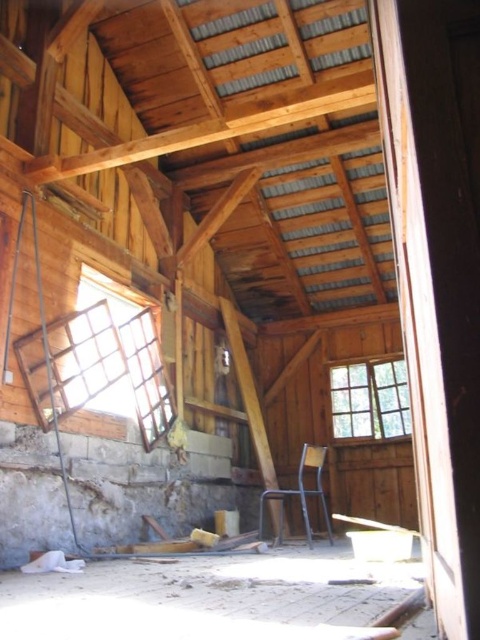
Question: Where is clear glass window at upper left located in relation to metallic chair at center in the image?

Choices:
 (A) below
 (B) above

Answer: (B)

Question: Which point is farther to the camera?

Choices:
 (A) clear glass window at upper left
 (B) clear glass window at right

Answer: (B)

Question: Which point is farther to the camera?

Choices:
 (A) (405, 420)
 (B) (308, 524)
 (C) (80, 294)

Answer: (A)

Question: Considering the relative positions of clear glass window at upper left and clear glass window at right in the image provided, where is clear glass window at upper left located with respect to clear glass window at right?

Choices:
 (A) above
 (B) below

Answer: (A)

Question: In this image, where is clear glass window at upper left located relative to clear glass window at right?

Choices:
 (A) below
 (B) above

Answer: (B)

Question: Which object is closer to the camera taking this photo?

Choices:
 (A) metallic chair at center
 (B) clear glass window at right

Answer: (A)